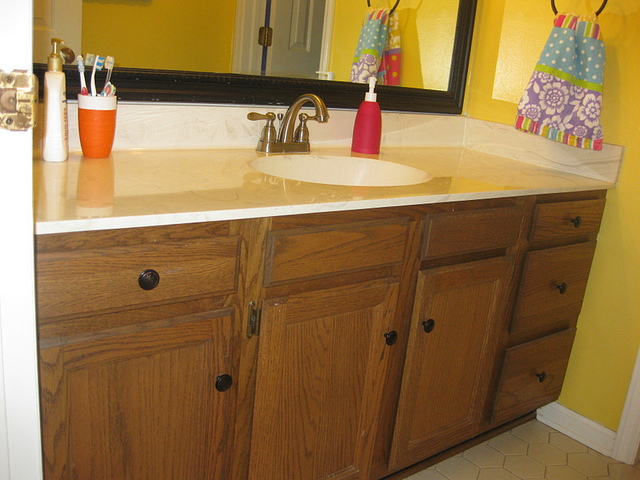
This screenshot has width=640, height=480. In order to click on sink in this screenshot , I will do `click(331, 169)`.